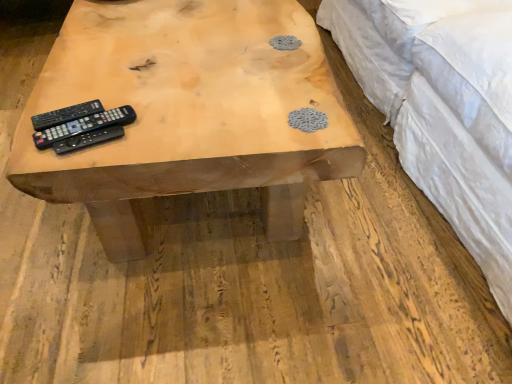
This screenshot has height=384, width=512. I want to click on vacant space behind black matte remote control at left, the 3th remote control from the front, so click(x=99, y=77).